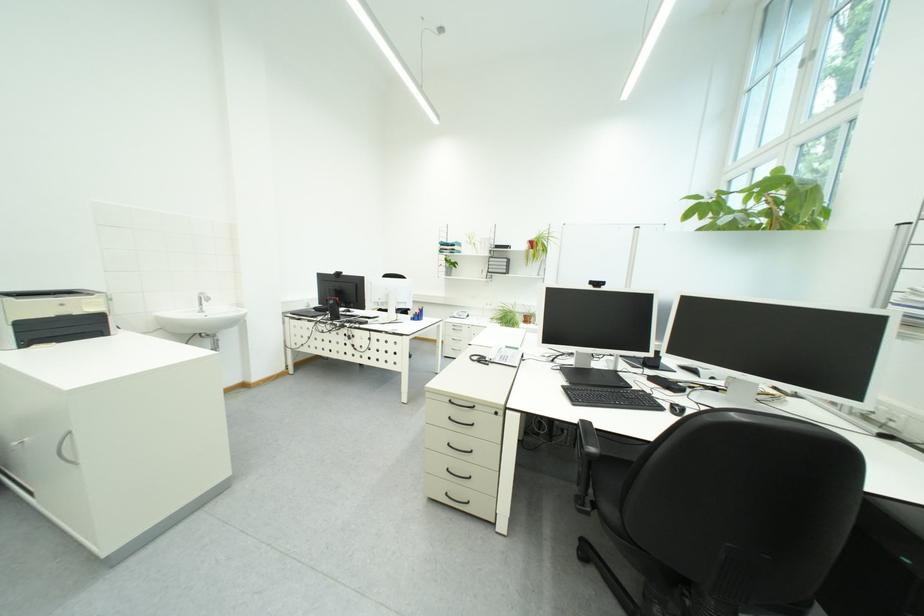
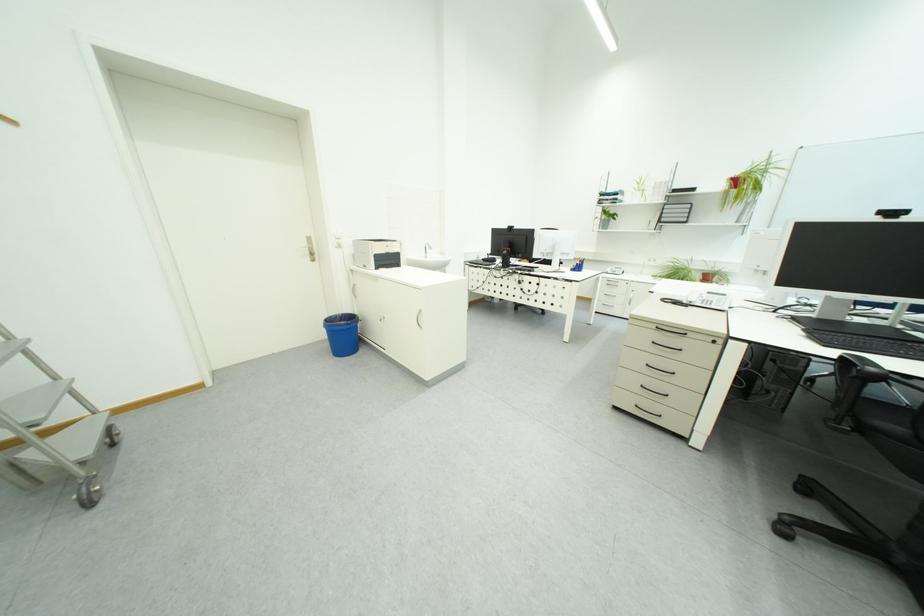
Question: The first image is from the beginning of the video and the second image is from the end. How did the camera likely rotate when shooting the video?

Choices:
 (A) Left
 (B) Right
 (C) Up
 (D) Down

Answer: (A)